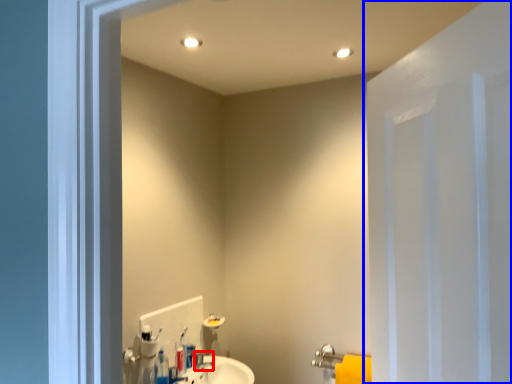
Question: Which point is further to the camera, plumbing fixture (highlighted by a red box) or door (highlighted by a blue box)?

Choices:
 (A) plumbing fixture
 (B) door

Answer: (A)